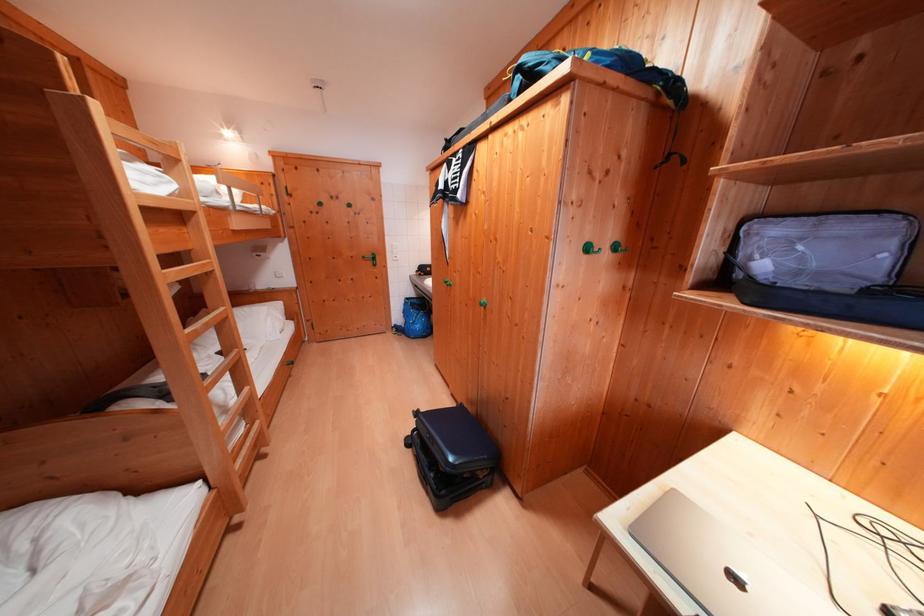
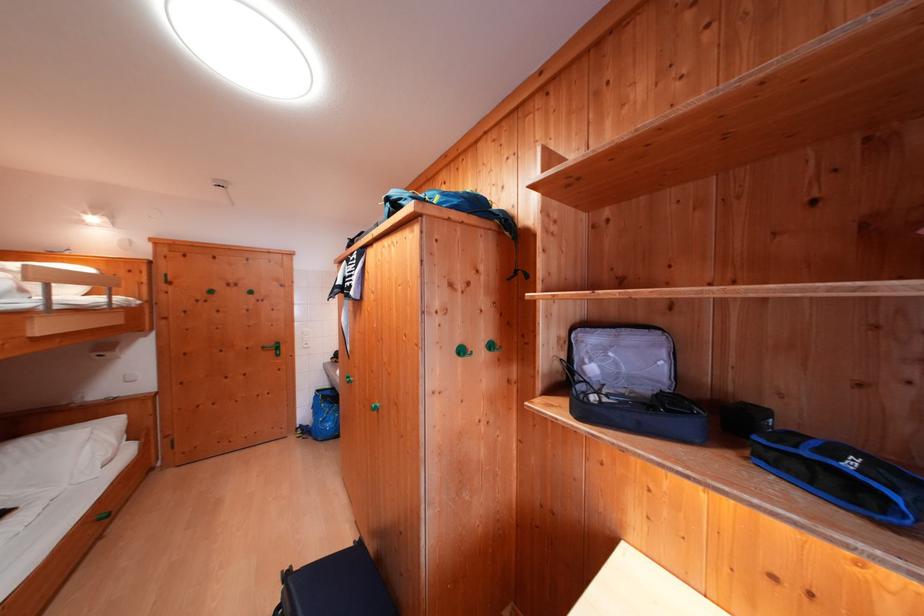
Where in the second image is the point corresponding to [596,253] from the first image?

(469, 355)